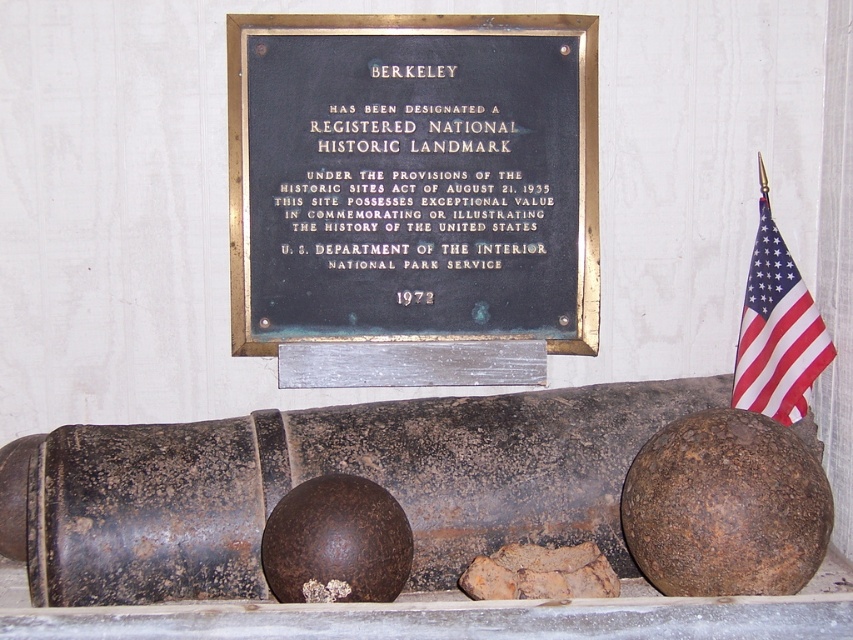
You are a tour guide explaining the historical site to visitors. You point to the black metal plaque at upper center and the rusty metal cannon at center. Which object is taller?

The black metal plaque at upper center is much taller than the rusty metal cannon at center.

You are a tour guide explaining the historical site to visitors. You point to the black metal plaque at upper center and the red fabric flag at right. Which object is taller?

The black metal plaque at upper center is taller than the red fabric flag at right.